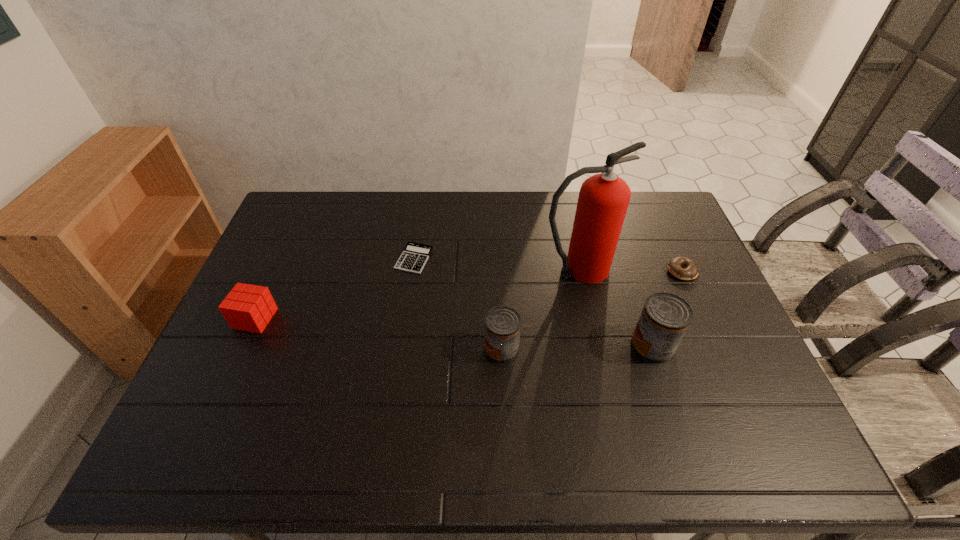
The height and width of the screenshot is (540, 960). Identify the location of the fourth object from right to left. (502, 325).

Image resolution: width=960 pixels, height=540 pixels. I want to click on the shorter can, so click(x=502, y=325).

Find the location of `the right can`. the right can is located at coordinates point(665,317).

Identify the location of the second tallest object. The height and width of the screenshot is (540, 960). (665, 317).

The width and height of the screenshot is (960, 540). What are the coordinates of `the shortest object` in the screenshot? It's located at (415, 255).

This screenshot has width=960, height=540. Identify the location of calculator. (415, 255).

Find the location of `cube`. cube is located at coordinates (247, 307).

This screenshot has height=540, width=960. I want to click on the third shortest object, so click(x=247, y=307).

The width and height of the screenshot is (960, 540). I want to click on the rightmost object, so click(675, 265).

The image size is (960, 540). Identify the location of the fifth tallest object. (675, 265).